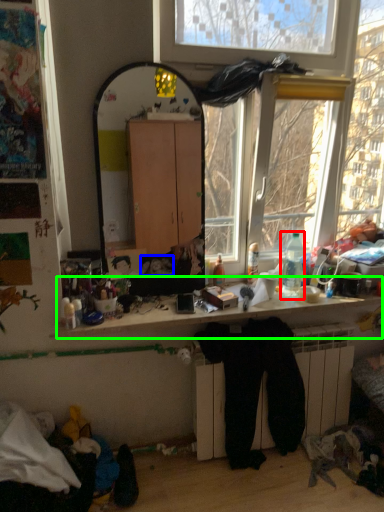
Question: Which object is the closest to the bottle (highlighted by a red box)? Choose among these: person (highlighted by a blue box) or computer desk (highlighted by a green box).

Choices:
 (A) person
 (B) computer desk

Answer: (B)